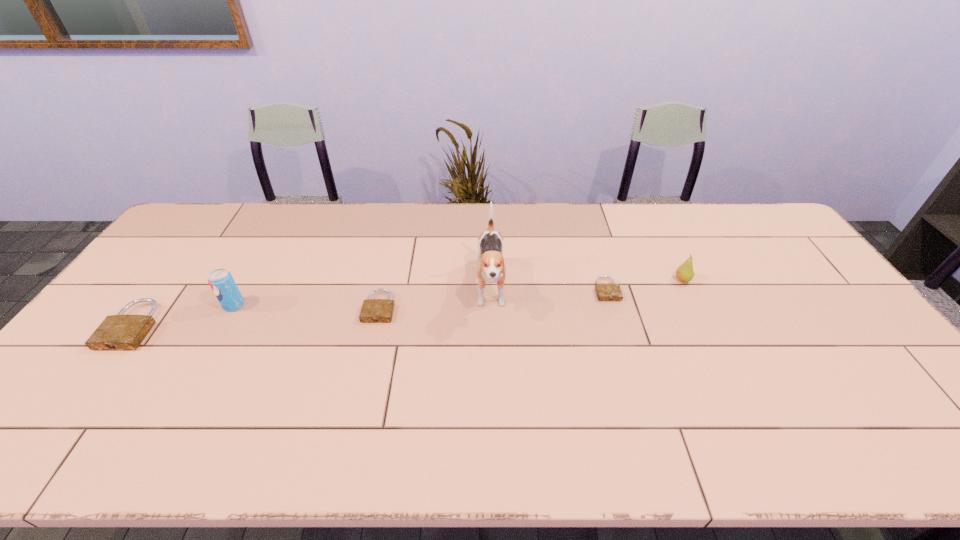
Identify the location of the leftmost object. (119, 332).

The height and width of the screenshot is (540, 960). Identify the location of the tallest padlock. (119, 332).

This screenshot has width=960, height=540. I want to click on the second shortest object, so click(373, 310).

Find the location of a particular element. The height and width of the screenshot is (540, 960). the second tallest padlock is located at coordinates (373, 310).

Find the location of a particular element. The height and width of the screenshot is (540, 960). the shortest object is located at coordinates (606, 291).

In order to click on the rightmost padlock in this screenshot , I will do `click(606, 291)`.

At what (x,y) coordinates should I click in order to perform the action: click on the fourth object from left to right. Please return your answer as a coordinate pair (x, y). This screenshot has width=960, height=540. Looking at the image, I should click on (491, 268).

I want to click on the tallest object, so click(491, 268).

Find the location of `the fifth object from right to left`. the fifth object from right to left is located at coordinates (221, 281).

Locate an element on the screen. The height and width of the screenshot is (540, 960). the fifth shortest object is located at coordinates (221, 281).